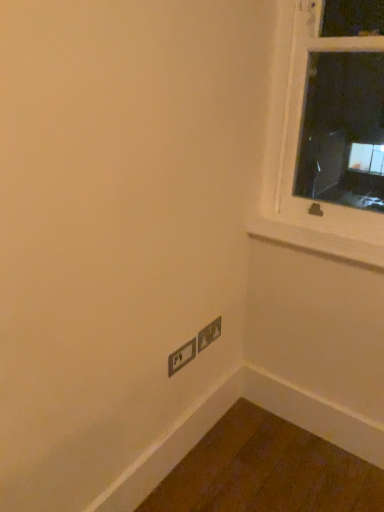
Question: In which direction should I rotate to look at matte black power plugs and sockets at lower center, the 1th power plugs and sockets viewed from the left?

Choices:
 (A) right
 (B) left

Answer: (B)

Question: Is matte black power plugs and sockets at lower center, which is counted as the second power plugs and sockets, starting from the right, located within matte gray power plugs and sockets at lower right, which is the first power plugs and sockets in right-to-left order?

Choices:
 (A) no
 (B) yes

Answer: (A)

Question: Considering the relative sizes of matte gray power plugs and sockets at lower right, which is the first power plugs and sockets in right-to-left order, and matte black power plugs and sockets at lower center, the 1th power plugs and sockets viewed from the left, in the image provided, is matte gray power plugs and sockets at lower right, which is the first power plugs and sockets in right-to-left order, bigger than matte black power plugs and sockets at lower center, the 1th power plugs and sockets viewed from the left,?

Choices:
 (A) no
 (B) yes

Answer: (A)

Question: From a real-world perspective, does matte gray power plugs and sockets at lower right, which is the first power plugs and sockets in right-to-left order, sit lower than matte black power plugs and sockets at lower center, the 1th power plugs and sockets viewed from the left?

Choices:
 (A) no
 (B) yes

Answer: (A)

Question: Can you confirm if matte gray power plugs and sockets at lower right, which is the first power plugs and sockets in right-to-left order, is taller than matte black power plugs and sockets at lower center, the 1th power plugs and sockets viewed from the left?

Choices:
 (A) yes
 (B) no

Answer: (A)

Question: Can you confirm if matte gray power plugs and sockets at lower right, which is the first power plugs and sockets in right-to-left order, is smaller than matte black power plugs and sockets at lower center, the 1th power plugs and sockets viewed from the left?

Choices:
 (A) no
 (B) yes

Answer: (B)

Question: Is matte gray power plugs and sockets at lower right, which ranks as the second power plugs and sockets in left-to-right order, facing away from matte black power plugs and sockets at lower center, the 1th power plugs and sockets viewed from the left?

Choices:
 (A) yes
 (B) no

Answer: (B)

Question: Does matte black power plugs and sockets at lower center, the 1th power plugs and sockets viewed from the left, have a lesser width compared to matte gray power plugs and sockets at lower right, which ranks as the second power plugs and sockets in left-to-right order?

Choices:
 (A) yes
 (B) no

Answer: (B)

Question: Can we say matte black power plugs and sockets at lower center, which is counted as the second power plugs and sockets, starting from the right, lies outside matte gray power plugs and sockets at lower right, which ranks as the second power plugs and sockets in left-to-right order?

Choices:
 (A) yes
 (B) no

Answer: (A)

Question: From the image's perspective, is matte black power plugs and sockets at lower center, the 1th power plugs and sockets viewed from the left, located beneath matte gray power plugs and sockets at lower right, which is the first power plugs and sockets in right-to-left order?

Choices:
 (A) no
 (B) yes

Answer: (B)

Question: Considering the relative sizes of matte black power plugs and sockets at lower center, the 1th power plugs and sockets viewed from the left, and matte gray power plugs and sockets at lower right, which ranks as the second power plugs and sockets in left-to-right order, in the image provided, is matte black power plugs and sockets at lower center, the 1th power plugs and sockets viewed from the left, taller than matte gray power plugs and sockets at lower right, which ranks as the second power plugs and sockets in left-to-right order,?

Choices:
 (A) no
 (B) yes

Answer: (A)

Question: From a real-world perspective, is matte black power plugs and sockets at lower center, the 1th power plugs and sockets viewed from the left, on top of matte gray power plugs and sockets at lower right, which ranks as the second power plugs and sockets in left-to-right order?

Choices:
 (A) no
 (B) yes

Answer: (A)

Question: From the image's perspective, is matte black power plugs and sockets at lower center, which is counted as the second power plugs and sockets, starting from the right, on top of matte gray power plugs and sockets at lower right, which ranks as the second power plugs and sockets in left-to-right order?

Choices:
 (A) yes
 (B) no

Answer: (B)

Question: Can you confirm if wooden at upper right is wider than matte gray power plugs and sockets at lower right, which ranks as the second power plugs and sockets in left-to-right order?

Choices:
 (A) no
 (B) yes

Answer: (B)